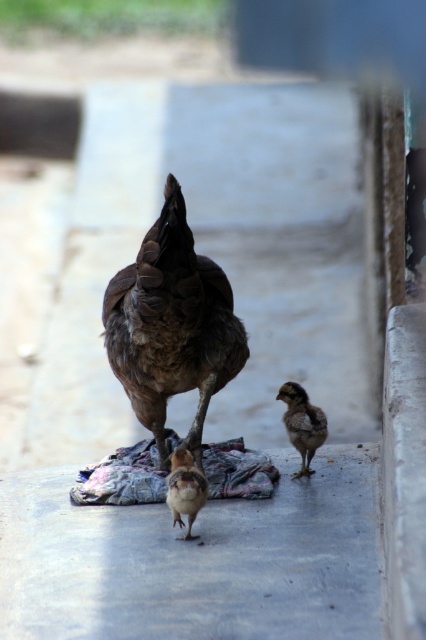
You are a small toy placed on the gray concrete at center. You want to see the brown feathered chicken at center clearly. Can you see its comb on top of its head from your current position?

The gray concrete at center is shorter than brown feathered chicken at center, so the toy cannot see the chicken comb because it is shorter and blocked by the chicken.

You are standing in a park and see a smooth concrete curb at right. If you want to place a 5 feet long board on the ground, can you fit it between yourself and the curb?

The smooth concrete curb at right is 4.98 feet from viewer. Since the distance is slightly less than 5 feet, the board cannot be placed between you and the curb as it would not fit entirely.

You are observing a hen and her chicks in the image. The hen is at the center, and there are two chicks nearby. Can you determine the exact coordinates of the brown feathered chicken at center?

The brown feathered chicken at center is located at point (172, 324).